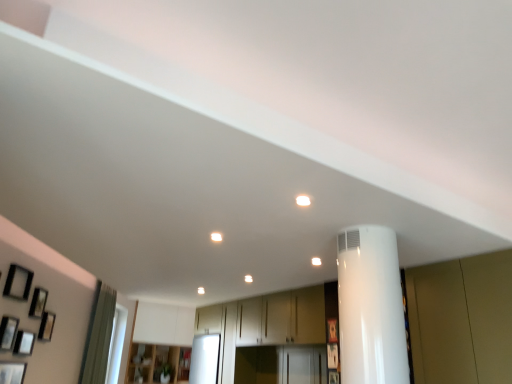
Question: Does wooden cabinet at center have a smaller size compared to wooden picture frame at left, the fifth picture frame in the left-to-right sequence?

Choices:
 (A) no
 (B) yes

Answer: (A)

Question: Is wooden cabinet at center in front of wooden picture frame at left, the fifth picture frame in the left-to-right sequence?

Choices:
 (A) no
 (B) yes

Answer: (A)

Question: Is wooden cabinet at center not within wooden picture frame at left, the fifth picture frame in the left-to-right sequence?

Choices:
 (A) yes
 (B) no

Answer: (A)

Question: Is wooden cabinet at center aimed at wooden picture frame at left, the fourth picture frame when ordered from right to left?

Choices:
 (A) yes
 (B) no

Answer: (B)

Question: From a real-world perspective, is wooden cabinet at center located beneath wooden picture frame at left, the fourth picture frame when ordered from right to left?

Choices:
 (A) yes
 (B) no

Answer: (A)

Question: From a real-world perspective, is wooden cabinet at center positioned over wooden picture frame at left, the fifth picture frame in the left-to-right sequence, based on gravity?

Choices:
 (A) yes
 (B) no

Answer: (B)

Question: Is matte black picture frame at lower left, arranged as the 8th picture frame when viewed from the right, oriented away from wooden picture frame at lower right, arranged as the 7th picture frame when viewed from the left?

Choices:
 (A) no
 (B) yes

Answer: (A)

Question: Is matte black picture frame at lower left, placed as the 1th picture frame when sorted from left to right, outside wooden picture frame at lower right, arranged as the 7th picture frame when viewed from the left?

Choices:
 (A) yes
 (B) no

Answer: (A)

Question: Does matte black picture frame at lower left, arranged as the 8th picture frame when viewed from the right, have a lesser height compared to wooden picture frame at lower right, arranged as the 7th picture frame when viewed from the left?

Choices:
 (A) yes
 (B) no

Answer: (B)

Question: Considering the relative sizes of matte black picture frame at lower left, arranged as the 8th picture frame when viewed from the right, and wooden picture frame at lower right, arranged as the 7th picture frame when viewed from the left, in the image provided, is matte black picture frame at lower left, arranged as the 8th picture frame when viewed from the right, bigger than wooden picture frame at lower right, arranged as the 7th picture frame when viewed from the left,?

Choices:
 (A) yes
 (B) no

Answer: (A)

Question: Is matte black picture frame at lower left, placed as the 1th picture frame when sorted from left to right, to the left of wooden picture frame at lower right, which appears as the second picture frame when viewed from the right, from the viewer's perspective?

Choices:
 (A) yes
 (B) no

Answer: (A)

Question: From the image's perspective, would you say matte black picture frame at lower left, arranged as the 8th picture frame when viewed from the right, is positioned over wooden picture frame at lower right, arranged as the 7th picture frame when viewed from the left?

Choices:
 (A) no
 (B) yes

Answer: (B)

Question: From a real-world perspective, is matte black picture frame at left, the 3th picture frame in the right-to-left sequence, under matte black picture frame at lower left, arranged as the 8th picture frame when viewed from the right?

Choices:
 (A) yes
 (B) no

Answer: (B)